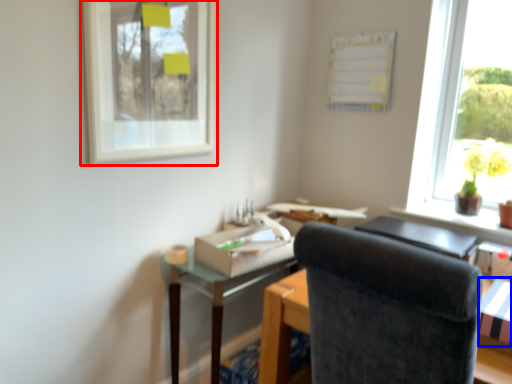
Question: Which object appears closest to the camera in this image, picture frame (highlighted by a red box) or cardboard box (highlighted by a blue box)?

Choices:
 (A) picture frame
 (B) cardboard box

Answer: (B)